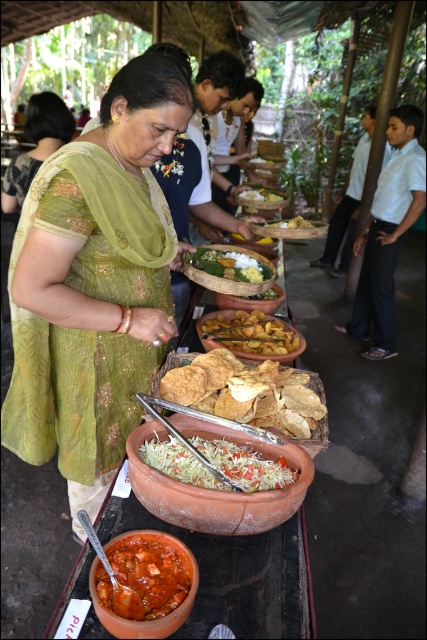
Question: Among these points, which one is farthest from the camera?

Choices:
 (A) click(x=167, y=292)
 (B) click(x=287, y=349)
 (C) click(x=181, y=580)

Answer: (B)

Question: Which point is farther to the camera?

Choices:
 (A) pos(266,292)
 (B) pos(29,108)
 (C) pos(295,227)
 (D) pos(186,259)

Answer: (C)

Question: Does green fabric saree at center have a greater width compared to yellowish matte bowl at center?

Choices:
 (A) no
 (B) yes

Answer: (A)

Question: Does green embroidered dress at center appear on the right side of green leafy vegetables at center?

Choices:
 (A) no
 (B) yes

Answer: (A)

Question: Considering the relative positions of tomato-based curry at center and green leafy vegetables at center in the image provided, where is tomato-based curry at center located with respect to green leafy vegetables at center?

Choices:
 (A) below
 (B) above

Answer: (A)

Question: Which point is closer to the camera?

Choices:
 (A) white matte rice at center
 (B) white matte plate at center

Answer: (A)